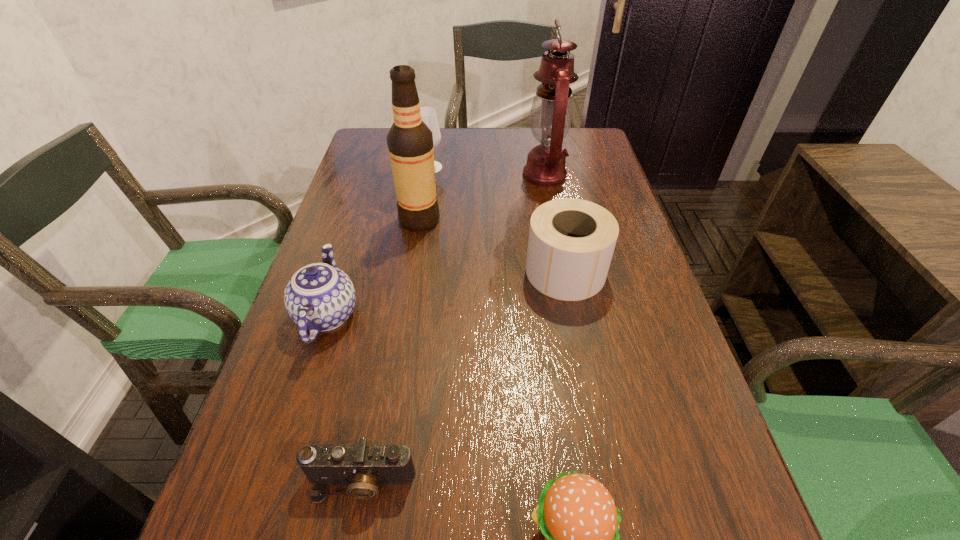
Identify which object is the fourth nearest to the toilet tissue. Please provide its 2D coordinates. Your answer should be formatted as a tuple, i.e. [(x, y)], where the tuple contains the x and y coordinates of a point satisfying the conditions above.

[(576, 514)]

The height and width of the screenshot is (540, 960). I want to click on vacant space that satisfies the following two spatial constraints: 1. on the front side of the oil lamp; 2. on the label of the fifth nearest object, so click(553, 220).

This screenshot has height=540, width=960. Identify the location of vacant space that satisfies the following two spatial constraints: 1. on the label of the third farthest object; 2. on the front-facing side of the shortest object. (378, 482).

What are the coordinates of `blank area in the image that satisfies the following two spatial constraints: 1. at the spout of the toilet tissue; 2. on the right side of the chinaware` in the screenshot? It's located at (341, 272).

What are the coordinates of `free space that satisfies the following two spatial constraints: 1. at the spout of the chinaware; 2. on the left side of the fifth shortest object` in the screenshot? It's located at (374, 167).